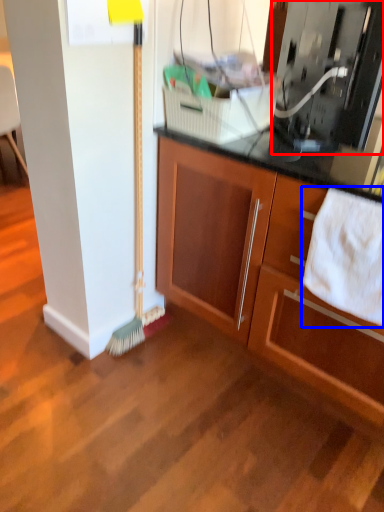
Question: Which object appears farthest to the camera in this image, appliance (highlighted by a red box) or bath towel (highlighted by a blue box)?

Choices:
 (A) appliance
 (B) bath towel

Answer: (B)